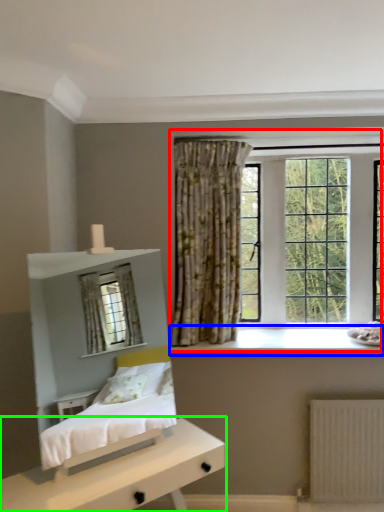
Question: Which object is the farthest from window (highlighted by a red box)? Choose among these: window sill (highlighted by a blue box) or nightstand (highlighted by a green box).

Choices:
 (A) window sill
 (B) nightstand

Answer: (B)